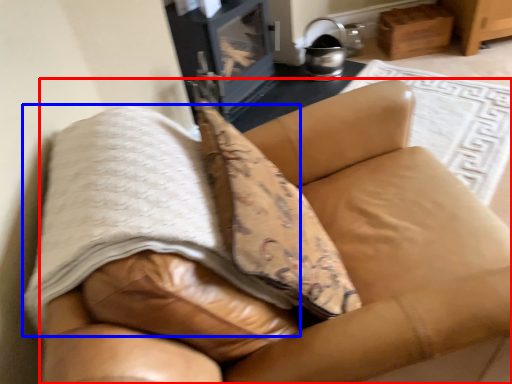
Question: Which object is closer to the camera taking this photo, furniture (highlighted by a red box) or blanket (highlighted by a blue box)?

Choices:
 (A) furniture
 (B) blanket

Answer: (A)